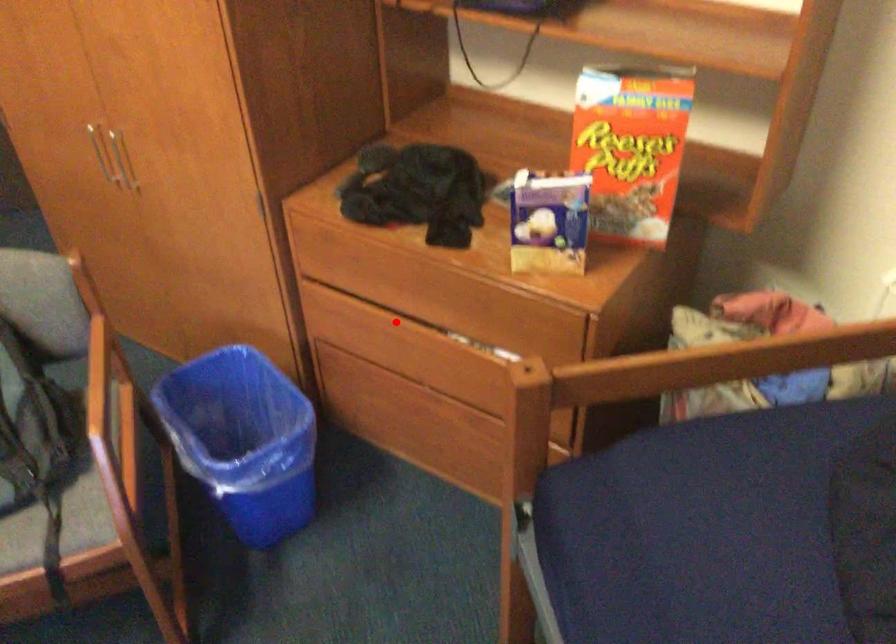
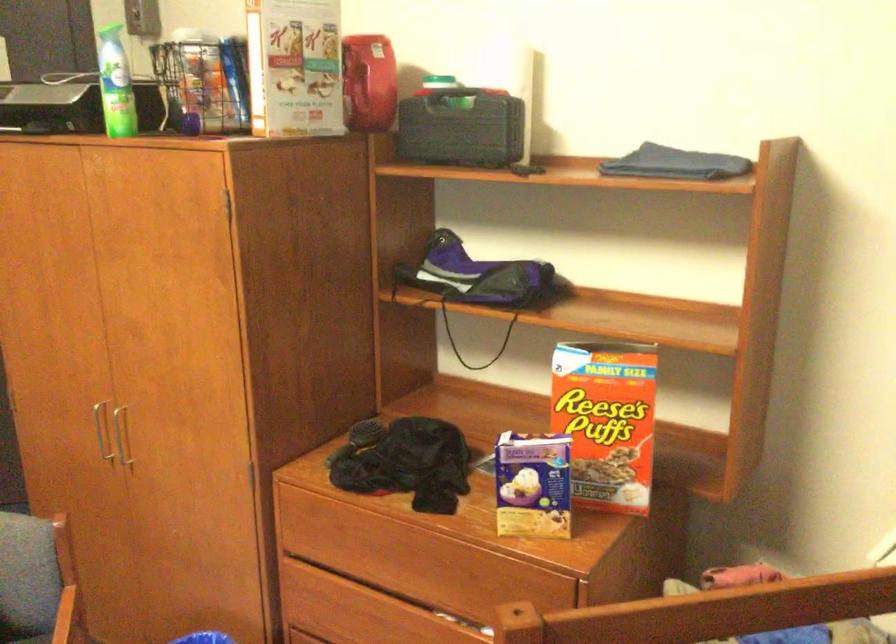
The point at the highlighted location is marked in the first image. Where is the corresponding point in the second image?

(377, 598)